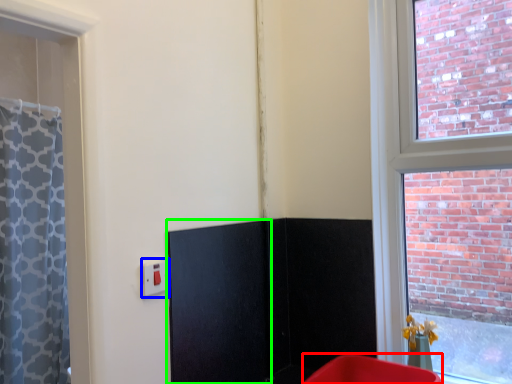
Question: Considering the real-world distances, which object is farthest from furniture (highlighted by a red box)? electric outlet (highlighted by a blue box) or screen door (highlighted by a green box)?

Choices:
 (A) electric outlet
 (B) screen door

Answer: (A)